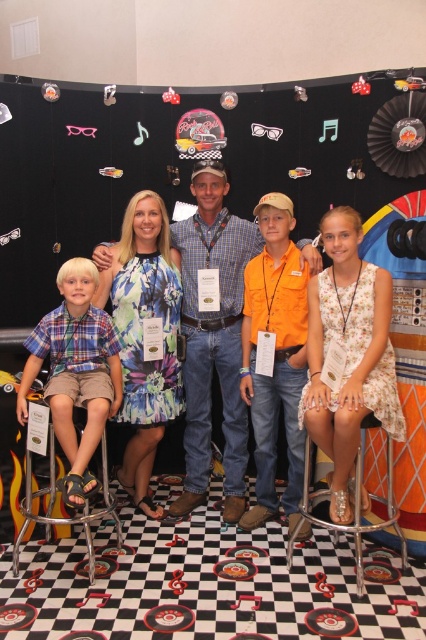
Question: Is plaid cotton shirt at left further to camera compared to metallic silver bar stool at lower left?

Choices:
 (A) yes
 (B) no

Answer: (B)

Question: Can you confirm if plaid cotton shirt at left is wider than metallic silver bar stool at lower left?

Choices:
 (A) no
 (B) yes

Answer: (B)

Question: Among these objects, which one is nearest to the camera?

Choices:
 (A) metallic silver bar stool at lower center
 (B) floral cotton dress at center
 (C) metallic silver bar stool at lower left

Answer: (B)

Question: Which object is farther from the camera taking this photo?

Choices:
 (A) checkered fabric shirt at center
 (B) floral cotton dress at center
 (C) metallic silver bar stool at lower center

Answer: (A)

Question: Does floral cotton dress at center have a greater width compared to metallic silver bar stool at lower center?

Choices:
 (A) yes
 (B) no

Answer: (B)

Question: Which object appears farthest from the camera in this image?

Choices:
 (A) metallic silver bar stool at lower left
 (B) plaid cotton shirt at left
 (C) metallic silver bar stool at lower center
 (D) floral cotton dress at center

Answer: (A)